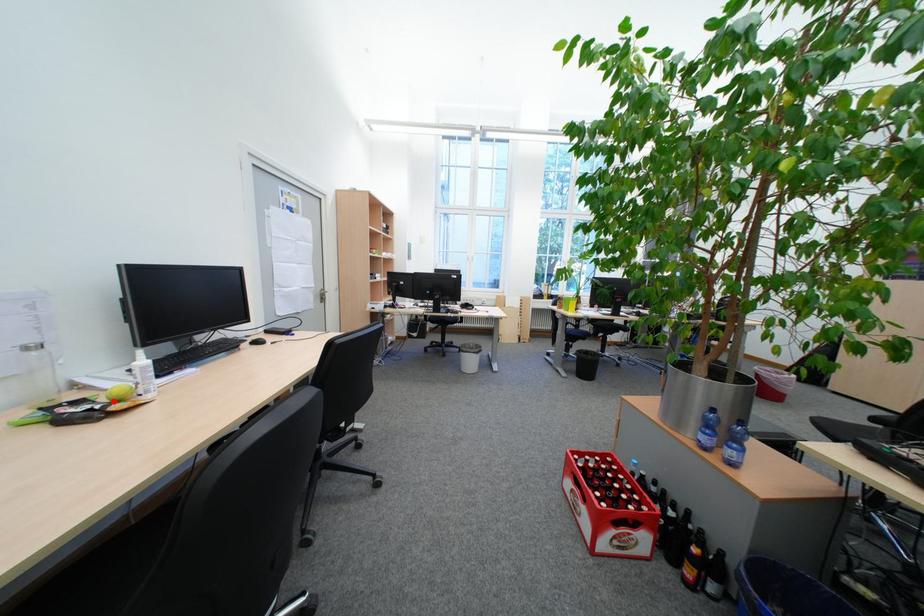
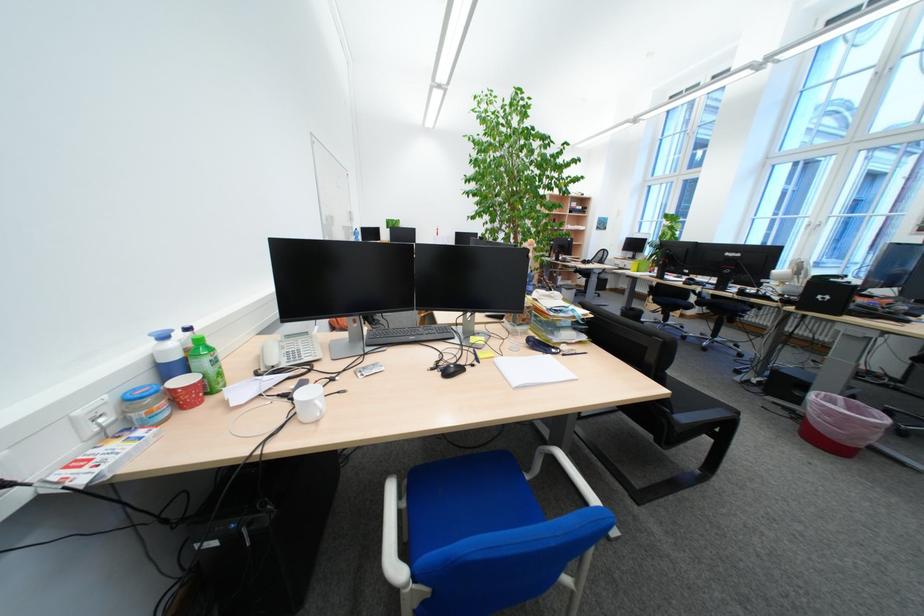
Question: I am providing you with two images of the same scene from different viewpoints. A red point is marked on the first image. Is the red point's position out of view in image 2?

Choices:
 (A) Yes
 (B) No

Answer: (A)